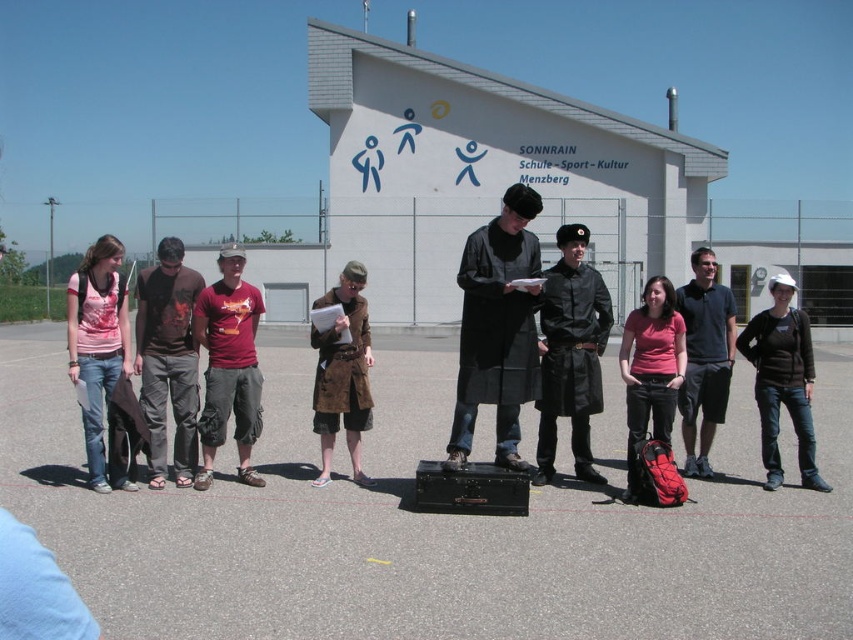
You are a photographer trying to capture a photo of the group. You want to ensure both the pink cotton shirt at left and the white matte baseball cap at center are visible in the frame. Based on their positions, which object should you focus on first to include both in the shot?

The pink cotton shirt at left is to the left of the white matte baseball cap at center, so focusing on the white matte baseball cap at center first would allow you to adjust the frame to include both objects since the pink cotton shirt at left is positioned to its left.